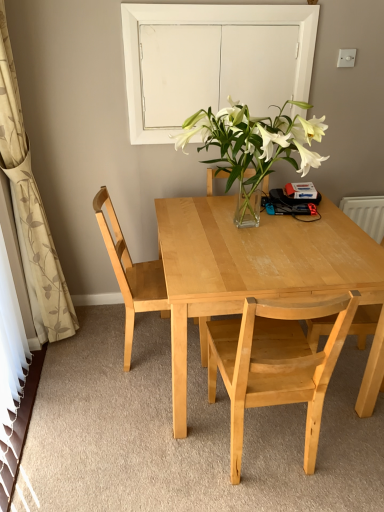
Where is `vacant space to the left of light wood table at center`? Image resolution: width=384 pixels, height=512 pixels. vacant space to the left of light wood table at center is located at coordinates (95, 399).